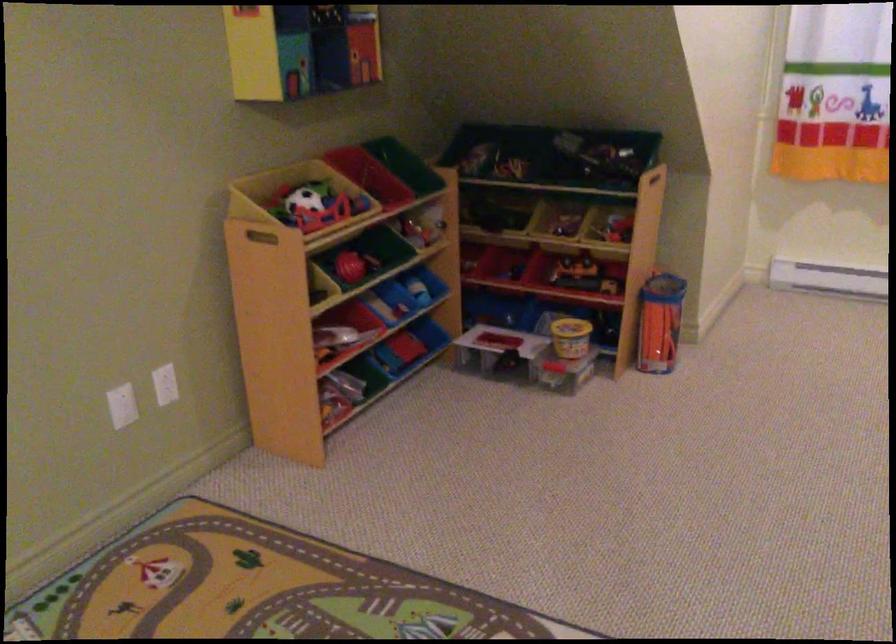
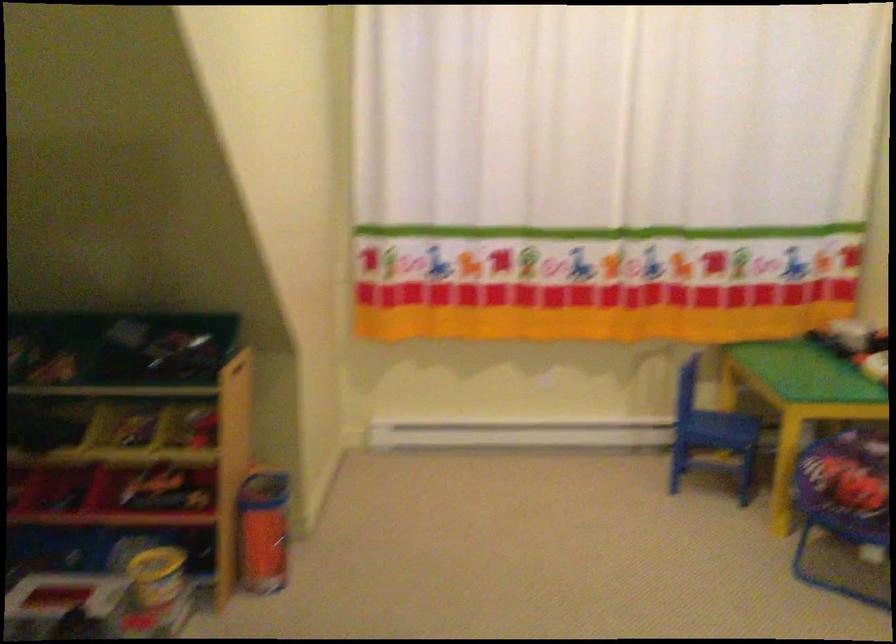
Find the pixel in the second image that matches (652,324) in the first image.

(263, 532)